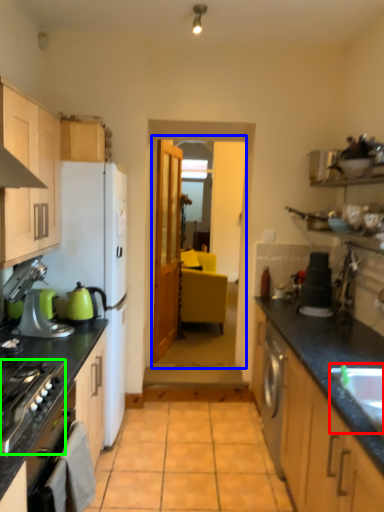
Question: Which object is the closest to the sink (highlighted by a red box)? Choose among these: glass door (highlighted by a blue box) or home appliance (highlighted by a green box).

Choices:
 (A) glass door
 (B) home appliance

Answer: (B)